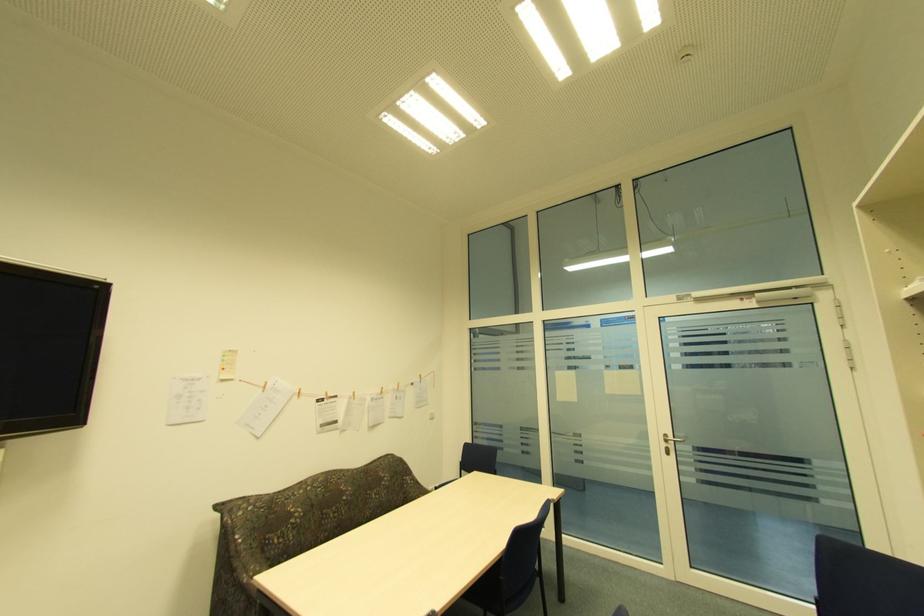
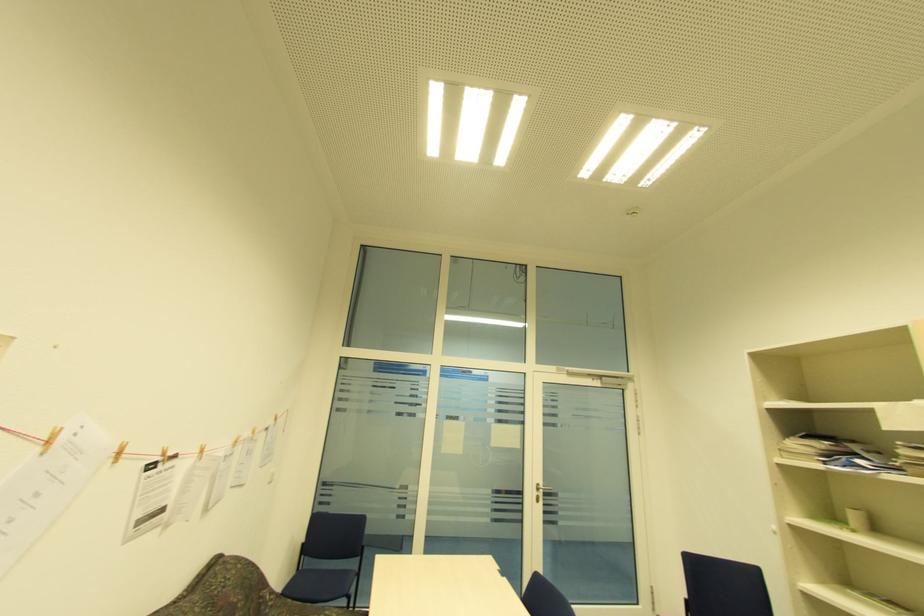
Locate, in the second image, the point that corresponds to (266,387) in the first image.

(51, 444)